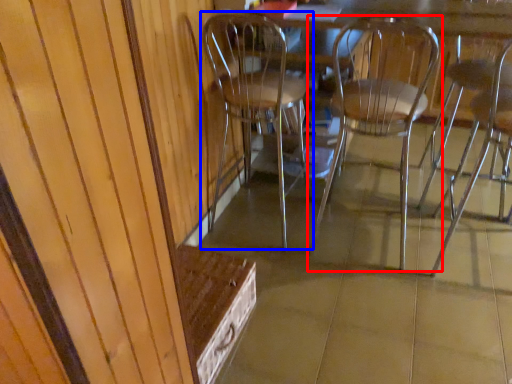
Question: Which object is closer to the camera taking this photo, chair (highlighted by a red box) or chair (highlighted by a blue box)?

Choices:
 (A) chair
 (B) chair

Answer: (A)